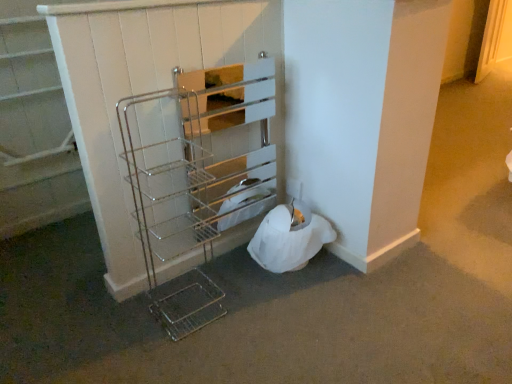
Find the location of a particular element. Image resolution: width=512 pixels, height=384 pixels. chrome/metallic wire rack at center, which is counted as the 2th shelf, starting from the left is located at coordinates pos(199,160).

Image resolution: width=512 pixels, height=384 pixels. Describe the element at coordinates (199, 160) in the screenshot. I see `chrome/metallic wire rack at center, which is counted as the 2th shelf, starting from the left` at that location.

From the picture: What is the approximate width of chrome/metallic wire rack at center, which is counted as the 2th shelf, starting from the left?

4.11 inches.

You are a GUI agent. You are given a task and a screenshot of the screen. Output one action in this format:
    pyautogui.click(x=<x>, y=<y>)
    Task: Click on the metallic wire shelf at upper left, positioned as the second shelf in right-to-left order
    The image size is (512, 384).
    Given the screenshot: What is the action you would take?
    pyautogui.click(x=34, y=133)

What do you see at coordinates (34, 133) in the screenshot?
I see `metallic wire shelf at upper left, positioned as the second shelf in right-to-left order` at bounding box center [34, 133].

You are a GUI agent. You are given a task and a screenshot of the screen. Output one action in this format:
    pyautogui.click(x=<x>, y=<y>)
    Task: Click on the chrome/metallic wire rack at center, which is the 1th shelf in right-to-left order
    The height and width of the screenshot is (384, 512).
    Given the screenshot: What is the action you would take?
    pyautogui.click(x=199, y=160)

Would you say chrome/metallic wire rack at center, which is counted as the 2th shelf, starting from the left, is to the left or to the right of metallic wire shelf at upper left, arranged as the 1th shelf when viewed from the left, in the picture?

chrome/metallic wire rack at center, which is counted as the 2th shelf, starting from the left, is positioned on metallic wire shelf at upper left, arranged as the 1th shelf when viewed from the left,'s right side.

In the scene shown: Is chrome/metallic wire rack at center, which is counted as the 2th shelf, starting from the left, in front of or behind metallic wire shelf at upper left, positioned as the second shelf in right-to-left order, in the image?

chrome/metallic wire rack at center, which is counted as the 2th shelf, starting from the left, is positioned closer to the viewer than metallic wire shelf at upper left, positioned as the second shelf in right-to-left order.

Between point (204, 90) and point (42, 142), which one is positioned in front?

The point (204, 90) is in front.

From the image's perspective, is chrome/metallic wire rack at center, which is the 1th shelf in right-to-left order, positioned above or below metallic wire shelf at upper left, positioned as the second shelf in right-to-left order?

Clearly, from the image's perspective, chrome/metallic wire rack at center, which is the 1th shelf in right-to-left order, is below metallic wire shelf at upper left, positioned as the second shelf in right-to-left order.

From a real-world perspective, is chrome/metallic wire rack at center, which is the 1th shelf in right-to-left order, beneath metallic wire shelf at upper left, positioned as the second shelf in right-to-left order?

Indeed, from a real-world perspective, chrome/metallic wire rack at center, which is the 1th shelf in right-to-left order, is positioned beneath metallic wire shelf at upper left, positioned as the second shelf in right-to-left order.

Looking at their sizes, would you say chrome/metallic wire rack at center, which is counted as the 2th shelf, starting from the left, is wider or thinner than metallic wire shelf at upper left, arranged as the 1th shelf when viewed from the left?

chrome/metallic wire rack at center, which is counted as the 2th shelf, starting from the left, is wider than metallic wire shelf at upper left, arranged as the 1th shelf when viewed from the left.

From their relative heights in the image, would you say chrome/metallic wire rack at center, which is the 1th shelf in right-to-left order, is taller or shorter than metallic wire shelf at upper left, arranged as the 1th shelf when viewed from the left?

chrome/metallic wire rack at center, which is the 1th shelf in right-to-left order, is taller than metallic wire shelf at upper left, arranged as the 1th shelf when viewed from the left.

Considering the sizes of objects chrome/metallic wire rack at center, which is counted as the 2th shelf, starting from the left, and metallic wire shelf at upper left, arranged as the 1th shelf when viewed from the left, in the image provided, who is bigger, chrome/metallic wire rack at center, which is counted as the 2th shelf, starting from the left, or metallic wire shelf at upper left, arranged as the 1th shelf when viewed from the left,?

Bigger between the two is chrome/metallic wire rack at center, which is counted as the 2th shelf, starting from the left.

Can metallic wire shelf at upper left, positioned as the second shelf in right-to-left order, be found inside chrome/metallic wire rack at center, which is the 1th shelf in right-to-left order?

No, metallic wire shelf at upper left, positioned as the second shelf in right-to-left order, is not surrounded by chrome/metallic wire rack at center, which is the 1th shelf in right-to-left order.

Is the surface of chrome/metallic wire rack at center, which is the 1th shelf in right-to-left order, in direct contact with metallic wire shelf at upper left, positioned as the second shelf in right-to-left order?

No.

Is chrome/metallic wire rack at center, which is counted as the 2th shelf, starting from the left, positioned with its back to metallic wire shelf at upper left, positioned as the second shelf in right-to-left order?

No, chrome/metallic wire rack at center, which is counted as the 2th shelf, starting from the left, is not facing the opposite direction of metallic wire shelf at upper left, positioned as the second shelf in right-to-left order.

Looking at this image, what's the angular difference between chrome/metallic wire rack at center, which is counted as the 2th shelf, starting from the left, and metallic wire shelf at upper left, positioned as the second shelf in right-to-left order,'s facing directions?

They differ by 0.0343 degrees in their facing directions.

Locate an element on the screen. The height and width of the screenshot is (384, 512). shelf located on the right of metallic wire shelf at upper left, arranged as the 1th shelf when viewed from the left is located at coordinates (199, 160).

Is metallic wire shelf at upper left, positioned as the second shelf in right-to-left order, to the right of chrome/metallic wire rack at center, which is the 1th shelf in right-to-left order, from the viewer's perspective?

Incorrect, metallic wire shelf at upper left, positioned as the second shelf in right-to-left order, is not on the right side of chrome/metallic wire rack at center, which is the 1th shelf in right-to-left order.

Between metallic wire shelf at upper left, positioned as the second shelf in right-to-left order, and chrome/metallic wire rack at center, which is counted as the 2th shelf, starting from the left, which one is positioned in front?

chrome/metallic wire rack at center, which is counted as the 2th shelf, starting from the left.

Which is closer to the camera, (59, 144) or (183, 93)?

Point (59, 144) is farther from the camera than point (183, 93).

From the image's perspective, is metallic wire shelf at upper left, positioned as the second shelf in right-to-left order, on chrome/metallic wire rack at center, which is counted as the 2th shelf, starting from the left?

Yes, from the image's perspective, metallic wire shelf at upper left, positioned as the second shelf in right-to-left order, is on top of chrome/metallic wire rack at center, which is counted as the 2th shelf, starting from the left.

From a real-world perspective, is metallic wire shelf at upper left, positioned as the second shelf in right-to-left order, physically located above or below chrome/metallic wire rack at center, which is the 1th shelf in right-to-left order?

metallic wire shelf at upper left, positioned as the second shelf in right-to-left order, is above chrome/metallic wire rack at center, which is the 1th shelf in right-to-left order.

Which object is thinner, metallic wire shelf at upper left, positioned as the second shelf in right-to-left order, or chrome/metallic wire rack at center, which is counted as the 2th shelf, starting from the left?

metallic wire shelf at upper left, positioned as the second shelf in right-to-left order.

Does metallic wire shelf at upper left, arranged as the 1th shelf when viewed from the left, have a lesser height compared to chrome/metallic wire rack at center, which is counted as the 2th shelf, starting from the left?

Indeed, metallic wire shelf at upper left, arranged as the 1th shelf when viewed from the left, has a lesser height compared to chrome/metallic wire rack at center, which is counted as the 2th shelf, starting from the left.

Considering the sizes of metallic wire shelf at upper left, positioned as the second shelf in right-to-left order, and chrome/metallic wire rack at center, which is counted as the 2th shelf, starting from the left, in the image, is metallic wire shelf at upper left, positioned as the second shelf in right-to-left order, bigger or smaller than chrome/metallic wire rack at center, which is counted as the 2th shelf, starting from the left,?

Considering their sizes, metallic wire shelf at upper left, positioned as the second shelf in right-to-left order, takes up less space than chrome/metallic wire rack at center, which is counted as the 2th shelf, starting from the left.

Is metallic wire shelf at upper left, positioned as the second shelf in right-to-left order, inside or outside of chrome/metallic wire rack at center, which is counted as the 2th shelf, starting from the left?

metallic wire shelf at upper left, positioned as the second shelf in right-to-left order, exists outside the volume of chrome/metallic wire rack at center, which is counted as the 2th shelf, starting from the left.

Is metallic wire shelf at upper left, arranged as the 1th shelf when viewed from the left, beside chrome/metallic wire rack at center, which is counted as the 2th shelf, starting from the left?

No, metallic wire shelf at upper left, arranged as the 1th shelf when viewed from the left, is not next to chrome/metallic wire rack at center, which is counted as the 2th shelf, starting from the left.

Does metallic wire shelf at upper left, arranged as the 1th shelf when viewed from the left, turn towards chrome/metallic wire rack at center, which is counted as the 2th shelf, starting from the left?

No, metallic wire shelf at upper left, arranged as the 1th shelf when viewed from the left, is not facing towards chrome/metallic wire rack at center, which is counted as the 2th shelf, starting from the left.

This screenshot has height=384, width=512. In order to click on shelf above the chrome/metallic wire rack at center, which is counted as the 2th shelf, starting from the left (from a real-world perspective) in this screenshot , I will do `click(34, 133)`.

Find the location of a particular element. shelf behind the chrome/metallic wire rack at center, which is counted as the 2th shelf, starting from the left is located at coordinates (34, 133).

Find the location of a particular element. This screenshot has height=384, width=512. shelf lying below the metallic wire shelf at upper left, arranged as the 1th shelf when viewed from the left (from the image's perspective) is located at coordinates (199, 160).